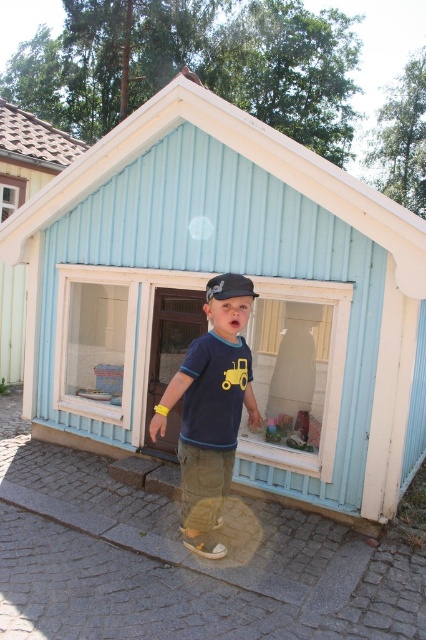
Is light blue wood at center closer to camera compared to black fabric baseball cap at center?

No, it is behind black fabric baseball cap at center.

Can you confirm if light blue wood at center is shorter than black fabric baseball cap at center?

Incorrect, light blue wood at center's height does not fall short of black fabric baseball cap at center's.

Describe the element at coordinates (253, 301) in the screenshot. I see `light blue wood at center` at that location.

In order to click on light blue wood at center in this screenshot , I will do `click(253, 301)`.

Is light blue wood at center taller than light blue wood at upper left?

No.

Can you confirm if light blue wood at center is smaller than light blue wood at upper left?

Yes, light blue wood at center is smaller than light blue wood at upper left.

This screenshot has width=426, height=640. In order to click on light blue wood at center in this screenshot , I will do `click(253, 301)`.

Locate an element on the screen. The height and width of the screenshot is (640, 426). light blue wood at center is located at coordinates (253, 301).

Who is shorter, light blue wood at center or matte blue shirt at center?

Standing shorter between the two is matte blue shirt at center.

Who is positioned more to the left, light blue wood at center or matte blue shirt at center?

From the viewer's perspective, matte blue shirt at center appears more on the left side.

Which is in front, point (371, 307) or point (152, 417)?

Positioned in front is point (371, 307).

I want to click on light blue wood at center, so click(253, 301).